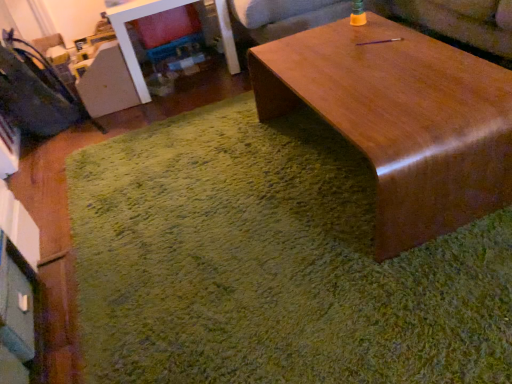
Question: Is glossy wood coffee table at center wider than velvet dark blue swivel chair at left?

Choices:
 (A) no
 (B) yes

Answer: (B)

Question: Is glossy wood coffee table at center further to camera compared to velvet dark blue swivel chair at left?

Choices:
 (A) no
 (B) yes

Answer: (A)

Question: Does glossy wood coffee table at center have a lesser width compared to velvet dark blue swivel chair at left?

Choices:
 (A) no
 (B) yes

Answer: (A)

Question: Does glossy wood coffee table at center turn towards velvet dark blue swivel chair at left?

Choices:
 (A) yes
 (B) no

Answer: (B)

Question: From a real-world perspective, is glossy wood coffee table at center beneath velvet dark blue swivel chair at left?

Choices:
 (A) no
 (B) yes

Answer: (B)

Question: Is glossy wood coffee table at center inside the boundaries of wooden couch at upper center, or outside?

Choices:
 (A) inside
 (B) outside

Answer: (B)

Question: Would you say glossy wood coffee table at center is to the left or to the right of wooden couch at upper center in the picture?

Choices:
 (A) left
 (B) right

Answer: (B)

Question: Looking at their shapes, would you say glossy wood coffee table at center is wider or thinner than wooden couch at upper center?

Choices:
 (A) thin
 (B) wide

Answer: (A)

Question: From the image's perspective, relative to wooden couch at upper center, is glossy wood coffee table at center above or below?

Choices:
 (A) below
 (B) above

Answer: (A)

Question: Based on their sizes in the image, would you say velvet dark blue swivel chair at left is bigger or smaller than green shaggy rug at center?

Choices:
 (A) big
 (B) small

Answer: (B)

Question: Is velvet dark blue swivel chair at left situated inside green shaggy rug at center or outside?

Choices:
 (A) outside
 (B) inside

Answer: (A)

Question: In the image, is velvet dark blue swivel chair at left positioned in front of or behind green shaggy rug at center?

Choices:
 (A) behind
 (B) front

Answer: (A)

Question: Is velvet dark blue swivel chair at left taller or shorter than green shaggy rug at center?

Choices:
 (A) short
 (B) tall

Answer: (B)

Question: Do you think velvet dark blue swivel chair at left is within glossy wood coffee table at center, or outside of it?

Choices:
 (A) outside
 (B) inside

Answer: (A)

Question: Relative to glossy wood coffee table at center, is velvet dark blue swivel chair at left in front or behind?

Choices:
 (A) behind
 (B) front

Answer: (A)